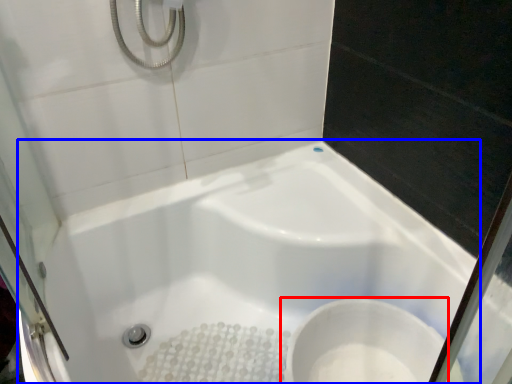
Question: Which object is further to the camera taking this photo, toilet (highlighted by a red box) or bathtub (highlighted by a blue box)?

Choices:
 (A) toilet
 (B) bathtub

Answer: (A)